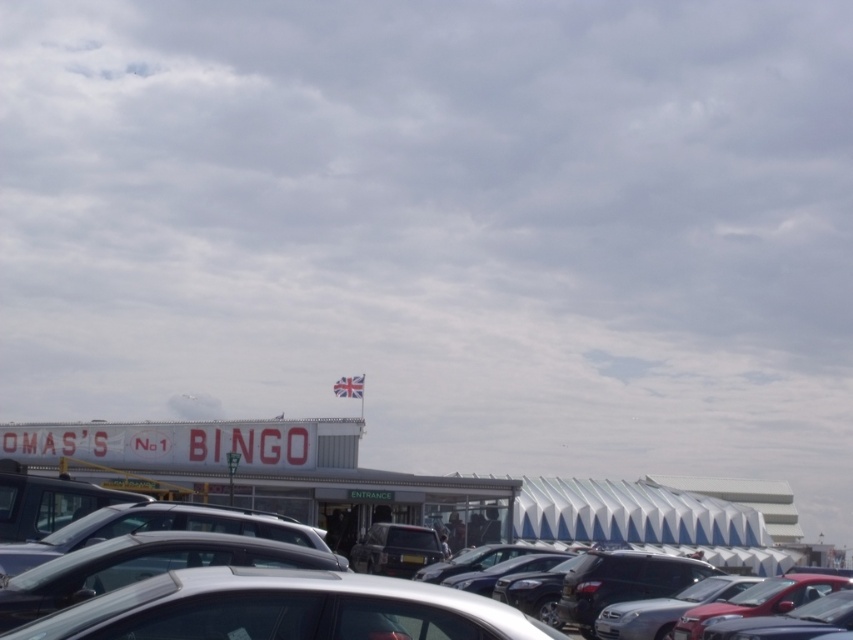
Which is more to the right, silver metallic car at center or matte silver car at center?

Positioned to the right is silver metallic car at center.

What do you see at coordinates (651, 518) in the screenshot? I see `silver metallic car at center` at bounding box center [651, 518].

This screenshot has width=853, height=640. Find the location of `silver metallic car at center`. silver metallic car at center is located at coordinates (651, 518).

Between point (521, 513) and point (843, 580), which one is positioned behind?

Positioned behind is point (521, 513).

Is silver metallic car at center thinner than shiny red car at lower right?

No, silver metallic car at center is not thinner than shiny red car at lower right.

Is point (651, 481) positioned behind point (776, 595)?

Yes, it is behind point (776, 595).

The height and width of the screenshot is (640, 853). Identify the location of silver metallic car at center. (651, 518).

Is silver metallic car at lower center further to camera compared to matte silver car at center?

No, silver metallic car at lower center is in front of matte silver car at center.

Between silver metallic car at lower center and matte silver car at center, which one appears on the right side from the viewer's perspective?

Positioned to the right is silver metallic car at lower center.

Image resolution: width=853 pixels, height=640 pixels. I want to click on silver metallic car at lower center, so click(x=283, y=609).